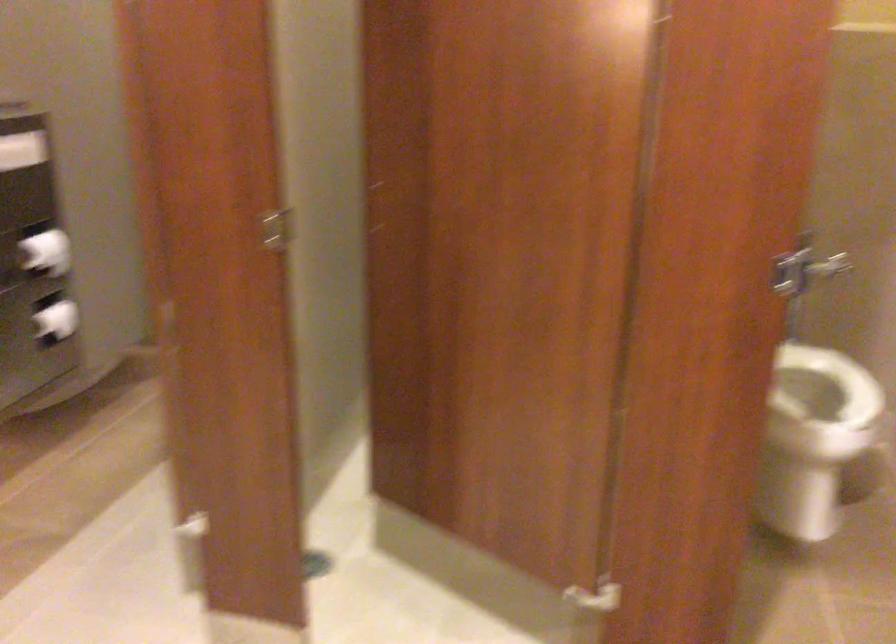
This screenshot has height=644, width=896. What are the coordinates of `toilet flush handle` in the screenshot? It's located at (830, 266).